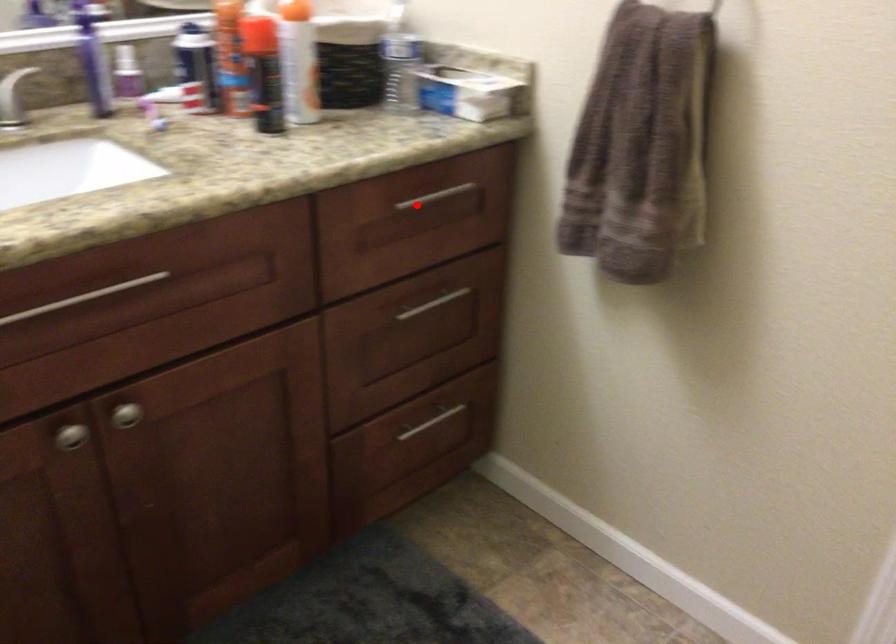
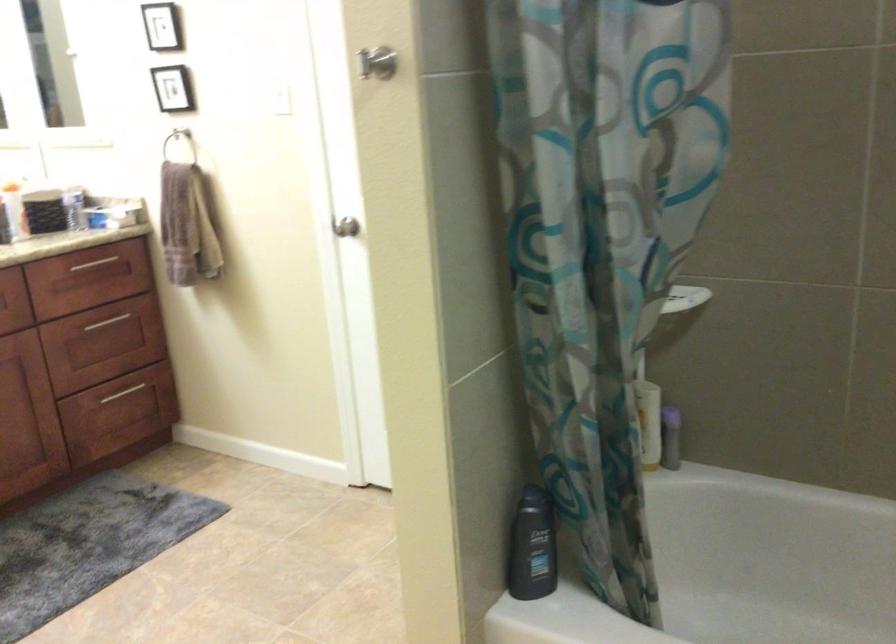
In the second image, find the point that corresponds to the highlighted location in the first image.

(92, 263)